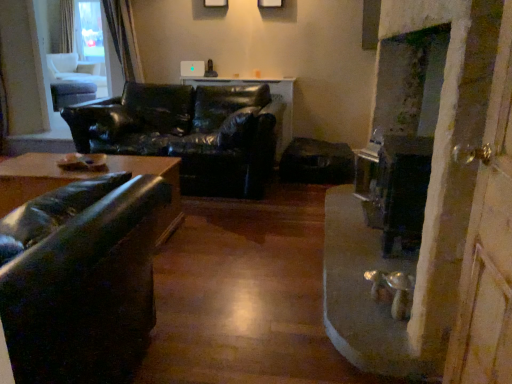
Question: Can you confirm if wooden screen door at right is wider than black leather couch at center, placed as the 1th studio couch when sorted from back to front?

Choices:
 (A) yes
 (B) no

Answer: (B)

Question: Could you tell me if wooden screen door at right is turned towards black leather couch at center, placed as the 1th studio couch when sorted from back to front?

Choices:
 (A) yes
 (B) no

Answer: (B)

Question: Considering the relative sizes of wooden screen door at right and black leather couch at center, the 2th studio couch when ordered from front to back, in the image provided, is wooden screen door at right taller than black leather couch at center, the 2th studio couch when ordered from front to back,?

Choices:
 (A) yes
 (B) no

Answer: (A)

Question: From a real-world perspective, is wooden screen door at right below black leather couch at center, placed as the 1th studio couch when sorted from back to front?

Choices:
 (A) yes
 (B) no

Answer: (B)

Question: Does wooden screen door at right have a lesser width compared to black leather couch at center, the 2th studio couch when ordered from front to back?

Choices:
 (A) no
 (B) yes

Answer: (B)

Question: Is black leather couch at center, the 2th studio couch when ordered from front to back, spatially inside matte black coffee table at center, or outside of it?

Choices:
 (A) inside
 (B) outside

Answer: (B)

Question: In the image, is black leather couch at center, placed as the 1th studio couch when sorted from back to front, on the left side or the right side of matte black coffee table at center?

Choices:
 (A) right
 (B) left

Answer: (A)

Question: From the image's perspective, relative to matte black coffee table at center, is black leather couch at center, the 2th studio couch when ordered from front to back, above or below?

Choices:
 (A) above
 (B) below

Answer: (B)

Question: From a real-world perspective, is black leather couch at center, placed as the 1th studio couch when sorted from back to front, physically located above or below matte black coffee table at center?

Choices:
 (A) below
 (B) above

Answer: (A)

Question: Does point (54, 86) appear closer or farther from the camera than point (128, 97)?

Choices:
 (A) closer
 (B) farther

Answer: (B)

Question: From the image's perspective, relative to black leather couch at center, placed as the 1th studio couch when sorted from back to front, is matte black coffee table at center above or below?

Choices:
 (A) below
 (B) above

Answer: (B)

Question: Based on their positions, is matte black coffee table at center located to the left or right of black leather couch at center, placed as the 1th studio couch when sorted from back to front?

Choices:
 (A) left
 (B) right

Answer: (A)

Question: From a real-world perspective, relative to black leather couch at center, the 2th studio couch when ordered from front to back, is matte black coffee table at center vertically above or below?

Choices:
 (A) below
 (B) above

Answer: (B)

Question: Considering the positions of wooden screen door at right and matte black coffee table at center in the image, is wooden screen door at right taller or shorter than matte black coffee table at center?

Choices:
 (A) tall
 (B) short

Answer: (A)

Question: From the image's perspective, is wooden screen door at right positioned above or below matte black coffee table at center?

Choices:
 (A) above
 (B) below

Answer: (B)